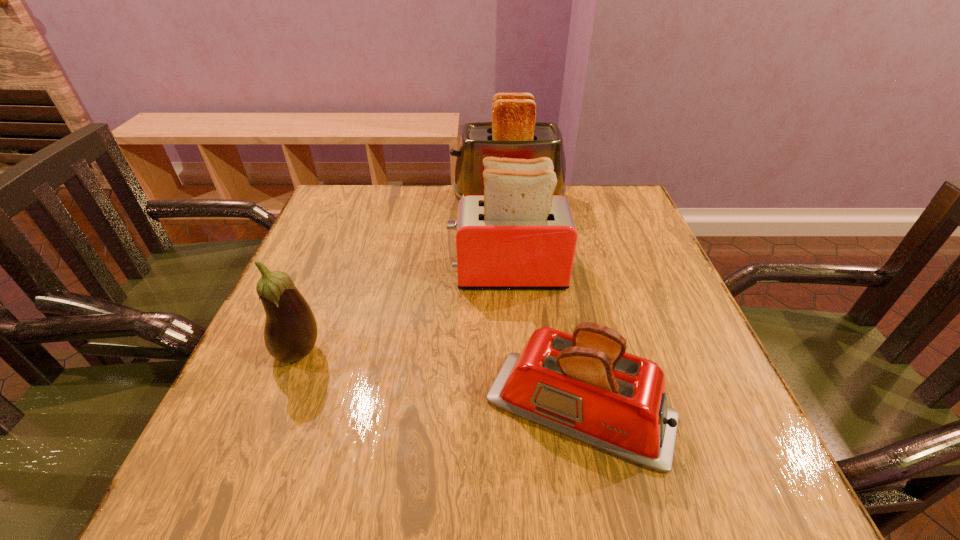
The image size is (960, 540). Identify the location of vacant space in between the leftmost object and the second farthest toaster. (403, 313).

Select which object is the closest to the third nearest object. Please provide its 2D coordinates. Your answer should be formatted as a tuple, i.e. [(x, y)], where the tuple contains the x and y coordinates of a point satisfying the conditions above.

[(513, 133)]

Point out which object is positioned as the nearest to the farthest object. Please provide its 2D coordinates. Your answer should be formatted as a tuple, i.e. [(x, y)], where the tuple contains the x and y coordinates of a point satisfying the conditions above.

[(518, 235)]

Identify the location of toaster that is the second closest to the second farthest object. The height and width of the screenshot is (540, 960). pyautogui.click(x=586, y=386).

The width and height of the screenshot is (960, 540). In order to click on toaster that can be found as the second closest to the nearest toaster in this screenshot , I will do `click(513, 133)`.

Where is `free space that satisfies the following two spatial constraints: 1. on the back side of the nearest toaster; 2. on the side of the farthest toaster with the control lever`? The width and height of the screenshot is (960, 540). free space that satisfies the following two spatial constraints: 1. on the back side of the nearest toaster; 2. on the side of the farthest toaster with the control lever is located at coordinates (540, 201).

Locate an element on the screen. free space that satisfies the following two spatial constraints: 1. on the side of the farthest toaster with the control lever; 2. on the front side of the eggplant is located at coordinates (522, 353).

The height and width of the screenshot is (540, 960). I want to click on vacant region that satisfies the following two spatial constraints: 1. on the front-facing side of the second farthest object; 2. on the right side of the nearest toaster, so click(517, 409).

Locate an element on the screen. The height and width of the screenshot is (540, 960). free space that satisfies the following two spatial constraints: 1. on the front-facing side of the second farthest toaster; 2. on the back side of the shortest object is located at coordinates (517, 409).

Find the location of `free space that satisfies the following two spatial constraints: 1. on the front-facing side of the shortest toaster; 2. on the right side of the second farthest toaster`. free space that satisfies the following two spatial constraints: 1. on the front-facing side of the shortest toaster; 2. on the right side of the second farthest toaster is located at coordinates pyautogui.click(x=517, y=409).